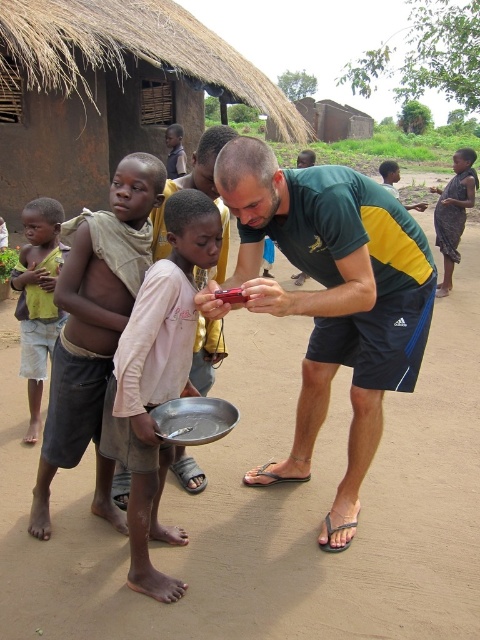
Question: Which is farther from the metallic silver bowl at center?

Choices:
 (A) yellow fabric shirt at left
 (B) dark brown skin at center
 (C) dark skin boy at center

Answer: (B)

Question: Is light brown skin at center above yellow fabric shirt at left?

Choices:
 (A) yes
 (B) no

Answer: (B)

Question: Which of the following is the farthest from the observer?

Choices:
 (A) (389, 188)
 (B) (453, 196)
 (C) (252, 275)

Answer: (A)

Question: Considering the relative positions of green/yellow athletic shirt at center and dark brown skin at center in the image provided, where is green/yellow athletic shirt at center located with respect to dark brown skin at center?

Choices:
 (A) below
 (B) above

Answer: (A)

Question: Which object is farther from the camera taking this photo?

Choices:
 (A) dark skin boy at center
 (B) metallic silver bowl at center

Answer: (A)

Question: Does light brown skin at center have a smaller size compared to metallic silver bowl at center?

Choices:
 (A) yes
 (B) no

Answer: (B)